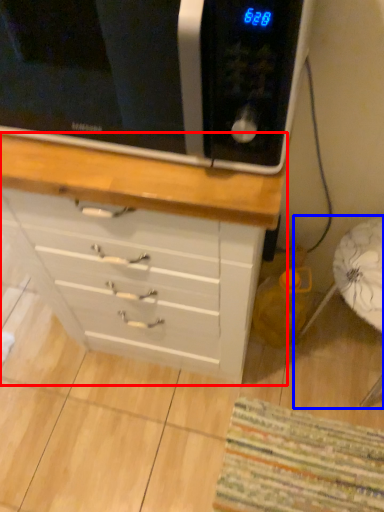
Question: Which object appears closest to the camera in this image, chest of drawers (highlighted by a red box) or swivel chair (highlighted by a blue box)?

Choices:
 (A) chest of drawers
 (B) swivel chair

Answer: (A)